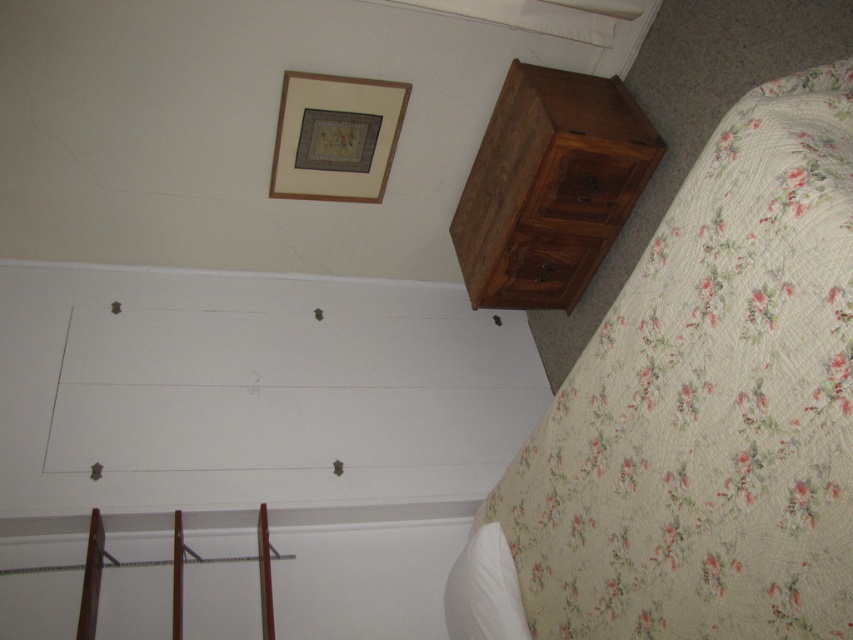
Looking at this image, does matte wood picture frame at upper center come in front of wooden drawer at upper right?

No, matte wood picture frame at upper center is further to the viewer.

Consider the image. Does matte wood picture frame at upper center have a greater width compared to wooden drawer at upper right?

Correct, the width of matte wood picture frame at upper center exceeds that of wooden drawer at upper right.

This screenshot has height=640, width=853. What do you see at coordinates (335, 136) in the screenshot?
I see `matte wood picture frame at upper center` at bounding box center [335, 136].

Identify the location of matte wood picture frame at upper center. (335, 136).

Is matte wood picture frame at upper center above white soft pillow at lower right?

Yes.

Does point (399, 106) lie in front of point (485, 616)?

No, it is behind (485, 616).

Is point (326, 164) in front of point (508, 611)?

No, it is not.

This screenshot has height=640, width=853. In order to click on matte wood picture frame at upper center in this screenshot , I will do `click(335, 136)`.

Does point (846, 248) come farther from viewer compared to point (578, 248)?

No, it is not.

Between floral quilted bed at lower right and dark brown wood drawer at upper right, which one has more height?

floral quilted bed at lower right is taller.

Is point (642, 308) farther from camera compared to point (544, 243)?

No, (642, 308) is in front of (544, 243).

The height and width of the screenshot is (640, 853). I want to click on floral quilted bed at lower right, so click(x=711, y=404).